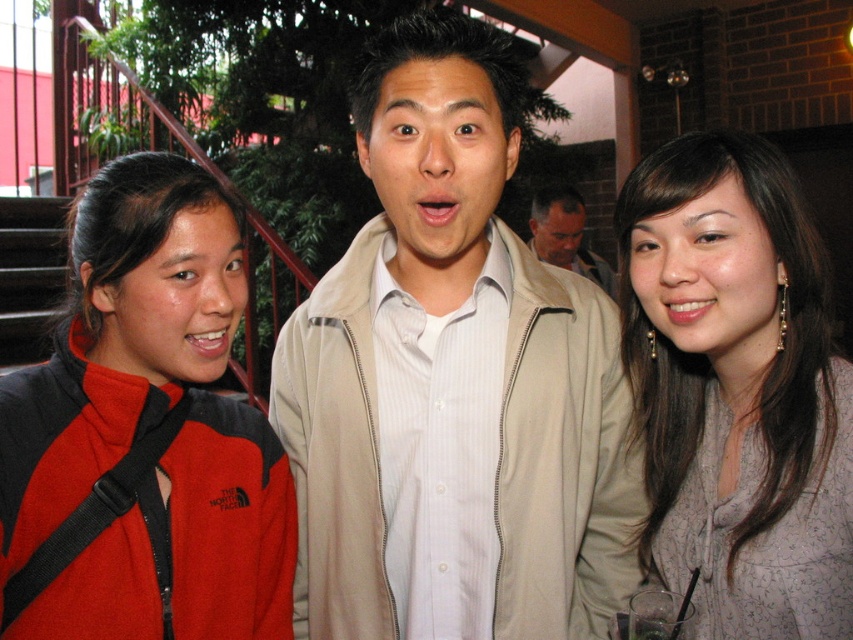
Between matte gray blouse at center and light beige jacket at center, which one is positioned lower?

Positioned lower is matte gray blouse at center.

Does matte gray blouse at center have a smaller size compared to light beige jacket at center?

Correct, matte gray blouse at center occupies less space than light beige jacket at center.

Is point (804, 467) closer to camera compared to point (585, 268)?

Yes, point (804, 467) is in front of point (585, 268).

This screenshot has width=853, height=640. In order to click on matte gray blouse at center in this screenshot , I will do `click(737, 388)`.

Is the position of red fleece jacket at left less distant than that of light beige jacket at center?

Yes.

Does red fleece jacket at left have a greater width compared to light beige jacket at center?

Incorrect, red fleece jacket at left's width does not surpass light beige jacket at center's.

Between point (160, 355) and point (560, 193), which one is positioned behind?

The point (560, 193) is more distant.

Identify the location of red fleece jacket at left. (144, 433).

Is beige fabric jacket at center above light beige jacket at center?

No, beige fabric jacket at center is not above light beige jacket at center.

Between beige fabric jacket at center and light beige jacket at center, which one has more height?

With more height is beige fabric jacket at center.

Which is behind, point (511, 364) or point (611, 269)?

The point (611, 269) is behind.

Identify the location of beige fabric jacket at center. (451, 381).